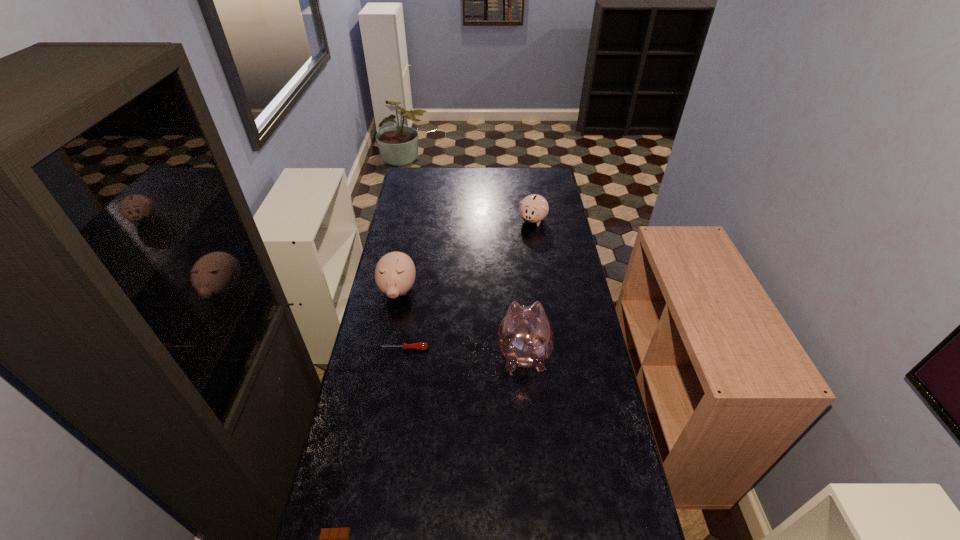
The width and height of the screenshot is (960, 540). I want to click on free space that satisfies the following two spatial constraints: 1. at the snout of the second tallest object; 2. on the right side of the screwdriver, so click(387, 349).

Identify the location of free point that satisfies the following two spatial constraints: 1. at the snout of the leftmost piggy bank; 2. on the left side of the fourth tallest object. Image resolution: width=960 pixels, height=540 pixels. (387, 349).